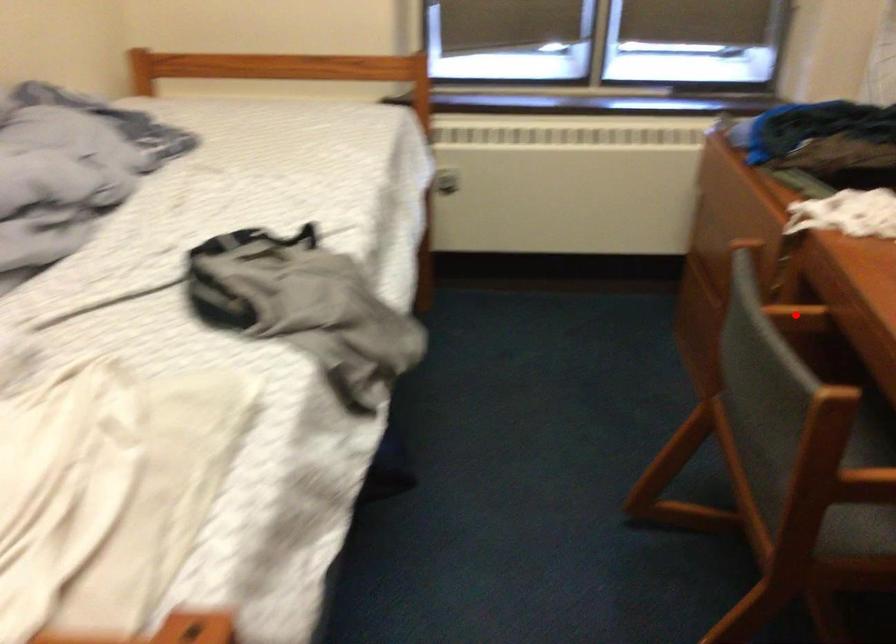
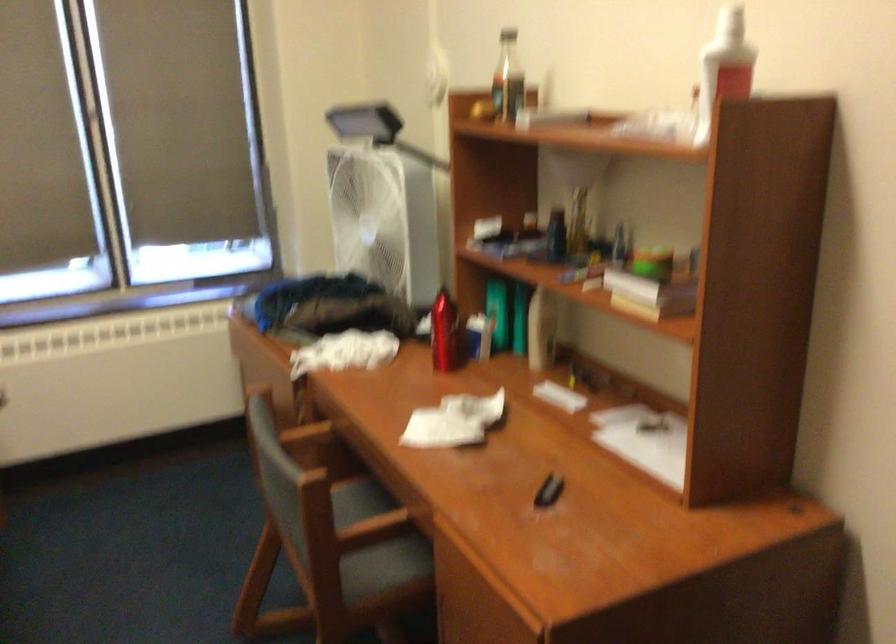
In the second image, find the point that corresponds to the highlighted location in the first image.

(306, 435)